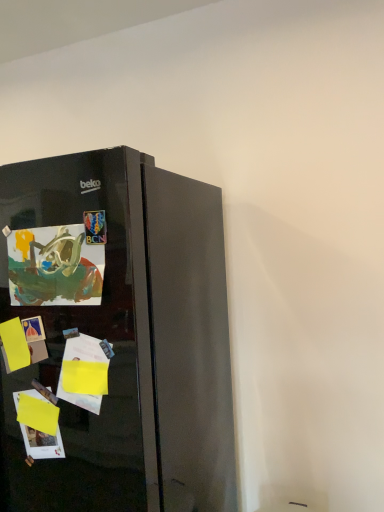
Locate an element on the screen. matte paper postcard at left is located at coordinates (54, 267).

Image resolution: width=384 pixels, height=512 pixels. What do you see at coordinates (54, 267) in the screenshot? I see `matte paper postcard at left` at bounding box center [54, 267].

In order to click on glossy black refrigerator at left in this screenshot , I will do `click(125, 334)`.

Measure the distance between point (155, 199) and camera.

3.59 feet.

What do you see at coordinates (125, 334) in the screenshot? Image resolution: width=384 pixels, height=512 pixels. I see `glossy black refrigerator at left` at bounding box center [125, 334].

Locate an element on the screen. matte paper postcard at left is located at coordinates (54, 267).

Considering the relative positions of glossy black refrigerator at left and matte paper postcard at left in the image provided, is glossy black refrigerator at left to the left of matte paper postcard at left from the viewer's perspective?

Indeed, glossy black refrigerator at left is positioned on the left side of matte paper postcard at left.

Who is more distant, glossy black refrigerator at left or matte paper postcard at left?

matte paper postcard at left is behind.

Which is farther, (110, 421) or (13, 264)?

Positioned behind is point (13, 264).

From the image's perspective, does glossy black refrigerator at left appear lower than matte paper postcard at left?

Indeed, from the image's perspective, glossy black refrigerator at left is shown beneath matte paper postcard at left.

Looking at this image, from a real-world perspective, between glossy black refrigerator at left and matte paper postcard at left, who is vertically higher?

matte paper postcard at left.

Is glossy black refrigerator at left wider than matte paper postcard at left?

Yes, glossy black refrigerator at left is wider than matte paper postcard at left.

Who is taller, glossy black refrigerator at left or matte paper postcard at left?

With more height is glossy black refrigerator at left.

Considering the sizes of objects glossy black refrigerator at left and matte paper postcard at left in the image provided, who is smaller, glossy black refrigerator at left or matte paper postcard at left?

With smaller size is matte paper postcard at left.

Does glossy black refrigerator at left contain matte paper postcard at left?

Yes, matte paper postcard at left can be found within glossy black refrigerator at left.

Can you see glossy black refrigerator at left touching matte paper postcard at left?

They are not placed beside each other.

Is glossy black refrigerator at left looking in the opposite direction of matte paper postcard at left?

That's not correct — glossy black refrigerator at left is not looking away from matte paper postcard at left.

How many degrees apart are the facing directions of glossy black refrigerator at left and matte paper postcard at left?

The facing directions of glossy black refrigerator at left and matte paper postcard at left are 0.858 degrees apart.

Where is `refrigerator below the matte paper postcard at left (from the image's perspective)`? The height and width of the screenshot is (512, 384). refrigerator below the matte paper postcard at left (from the image's perspective) is located at coordinates (125, 334).

Considering the positions of objects matte paper postcard at left and glossy black refrigerator at left in the image provided, who is more to the left, matte paper postcard at left or glossy black refrigerator at left?

From the viewer's perspective, glossy black refrigerator at left appears more on the left side.

Which is behind, matte paper postcard at left or glossy black refrigerator at left?

matte paper postcard at left is further away from the camera.

Is point (71, 256) farther from viewer compared to point (203, 265)?

No, it is not.

From the image's perspective, is matte paper postcard at left located above or below glossy black refrigerator at left?

matte paper postcard at left is situated higher than glossy black refrigerator at left in the image.

From a real-world perspective, who is located lower, matte paper postcard at left or glossy black refrigerator at left?

glossy black refrigerator at left.

Is matte paper postcard at left wider or thinner than glossy black refrigerator at left?

Considering their sizes, matte paper postcard at left looks slimmer than glossy black refrigerator at left.

Is matte paper postcard at left shorter than glossy black refrigerator at left?

Correct, matte paper postcard at left is not as tall as glossy black refrigerator at left.

Can you confirm if matte paper postcard at left is bigger than glossy black refrigerator at left?

No.

Could glossy black refrigerator at left be considered to be inside matte paper postcard at left?

No.

Is there a large distance between matte paper postcard at left and glossy black refrigerator at left?

No, matte paper postcard at left is in close proximity to glossy black refrigerator at left.

Is matte paper postcard at left looking in the opposite direction of glossy black refrigerator at left?

Answer: Correct, matte paper postcard at left is looking away from glossy black refrigerator at left.

How different are the orientations of matte paper postcard at left and glossy black refrigerator at left in degrees?

There is a 0.858-degree angle between the facing directions of matte paper postcard at left and glossy black refrigerator at left.

Measure the distance between matte paper postcard at left and glossy black refrigerator at left.

A distance of 6.18 inches exists between matte paper postcard at left and glossy black refrigerator at left.

Find the location of a particular element. The height and width of the screenshot is (512, 384). refrigerator on the left of the matte paper postcard at left is located at coordinates (125, 334).

Find the location of a particular element. The height and width of the screenshot is (512, 384). refrigerator on the left of matte paper postcard at left is located at coordinates (125, 334).

Where is `refrigerator below the matte paper postcard at left (from the image's perspective)`? The height and width of the screenshot is (512, 384). refrigerator below the matte paper postcard at left (from the image's perspective) is located at coordinates (125, 334).